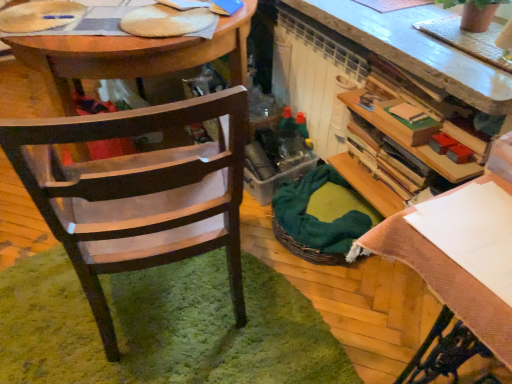
Locate an element on the screen. Image resolution: width=512 pixels, height=384 pixels. free point below terracotta textured pot at upper right (from a real-world perspective) is located at coordinates (462, 25).